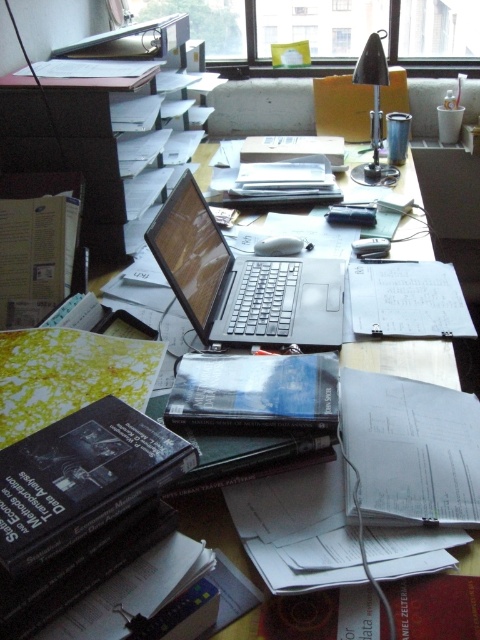
Question: Estimate the real-world distances between objects in this image. Which object is closer to the black metallic lamp at upper right?

Choices:
 (A) satin black laptop at center
 (B) black matte binder at lower left

Answer: (A)

Question: Which of these objects is positioned closest to the black metallic lamp at upper right?

Choices:
 (A) satin black laptop at center
 (B) black matte binder at lower left

Answer: (A)

Question: Is black matte binder at lower left wider than black matte book at center?

Choices:
 (A) yes
 (B) no

Answer: (B)

Question: Estimate the real-world distances between objects in this image. Which object is farther from the black matte binder at lower left?

Choices:
 (A) black metallic lamp at upper right
 (B) black matte book at center

Answer: (A)

Question: Can you confirm if satin black laptop at center is bigger than black matte book at center?

Choices:
 (A) no
 (B) yes

Answer: (B)

Question: Can you confirm if satin black laptop at center is thinner than black matte book at center?

Choices:
 (A) yes
 (B) no

Answer: (B)